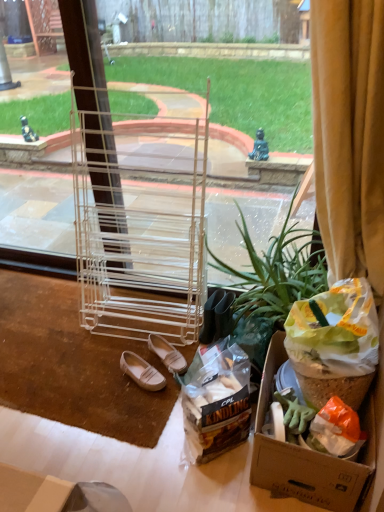
The width and height of the screenshot is (384, 512). Describe the element at coordinates (276, 273) in the screenshot. I see `green leafy plant at center` at that location.

Describe the element at coordinates (141, 372) in the screenshot. I see `white leather shoes at lower center, which is counted as the 2th footwear, starting from the right` at that location.

Measure the distance between yellow velvet curtain at right and camera.

The distance of yellow velvet curtain at right from camera is 3.54 feet.

What is the approximate width of translucent plastic bag of kindling at lower center?

translucent plastic bag of kindling at lower center is 9.59 inches wide.

At what (x,y) coordinates should I click in order to perform the action: click on green leafy plant at center. Please return your answer as a coordinate pair (x, y). The image size is (384, 512). Looking at the image, I should click on (276, 273).

Which of these two, white leather shoes at lower center, which is the 1th footwear from left to right, or translucent plastic bag of kindling at lower center, is thinner?

translucent plastic bag of kindling at lower center.

In the image, is white leather shoes at lower center, which is the 1th footwear from left to right, positioned in front of or behind translucent plastic bag of kindling at lower center?

Visually, white leather shoes at lower center, which is the 1th footwear from left to right, is located behind translucent plastic bag of kindling at lower center.

From the image's perspective, is white leather shoes at lower center, which is the 1th footwear from left to right, over translucent plastic bag of kindling at lower center?

Yes, from the image's perspective, white leather shoes at lower center, which is the 1th footwear from left to right, is on top of translucent plastic bag of kindling at lower center.

Considering the relative sizes of clear plastic rack at center and translucent plastic bag of kindling at lower center in the image provided, is clear plastic rack at center smaller than translucent plastic bag of kindling at lower center?

No.

Is point (209, 228) positioned in front of point (222, 405)?

That is False.

From a real-world perspective, is clear plastic rack at center physically below translucent plastic bag of kindling at lower center?

No, from a real-world perspective, clear plastic rack at center is not below translucent plastic bag of kindling at lower center.

Find the location of a particular element. window screen on the left of the translucent plastic bag of kindling at lower center is located at coordinates (203, 94).

Between white leather shoes at lower center, which is the 1th footwear from left to right, and clear plastic rack at center, which one appears on the left side from the viewer's perspective?

Positioned to the left is white leather shoes at lower center, which is the 1th footwear from left to right.

Is point (120, 360) less distant than point (162, 118)?

That is False.

Is white leather shoes at lower center, which is counted as the 2th footwear, starting from the right, wider than clear plastic rack at center?

Indeed, white leather shoes at lower center, which is counted as the 2th footwear, starting from the right, has a greater width compared to clear plastic rack at center.

Considering the sizes of objects white leather shoes at lower center, which is counted as the 2th footwear, starting from the right, and clear plastic rack at center in the image provided, who is bigger, white leather shoes at lower center, which is counted as the 2th footwear, starting from the right, or clear plastic rack at center?

Bigger between the two is clear plastic rack at center.

Looking at this image, which is more to the right, green leafy plant at center or clear plastic rack at center?

green leafy plant at center is more to the right.

Is green leafy plant at center facing towards clear plastic rack at center?

Yes, green leafy plant at center is aimed at clear plastic rack at center.

Is point (299, 229) less distant than point (25, 201)?

Yes, point (299, 229) is closer to viewer.

Is green leafy plant at center closer to camera compared to clear plastic rack at center?

No, green leafy plant at center is behind clear plastic rack at center.

Looking at their sizes, would you say leather at center, the 2th footwear when ordered from left to right, is wider or thinner than white leather shoes at lower center, which is counted as the 2th footwear, starting from the right?

leather at center, the 2th footwear when ordered from left to right, is thinner than white leather shoes at lower center, which is counted as the 2th footwear, starting from the right.

Consider the image. Which is closer, (181, 370) or (140, 379)?

The point (140, 379) is closer.

Is leather at center, which ranks as the 1th footwear in right-to-left order, outside of white leather shoes at lower center, which is counted as the 2th footwear, starting from the right?

leather at center, which ranks as the 1th footwear in right-to-left order, lies outside white leather shoes at lower center, which is counted as the 2th footwear, starting from the right,'s area.

In the scene shown: Does green leafy plant at center have a larger size compared to yellow velvet curtain at right?

Correct, green leafy plant at center is larger in size than yellow velvet curtain at right.

How different are the orientations of green leafy plant at center and yellow velvet curtain at right in degrees?

green leafy plant at center and yellow velvet curtain at right are facing 87.1 degrees away from each other.

Is green leafy plant at center inside the boundaries of yellow velvet curtain at right, or outside?

green leafy plant at center is outside yellow velvet curtain at right.

From the image's perspective, which object appears higher, green leafy plant at center or yellow velvet curtain at right?

yellow velvet curtain at right appears higher in the image.

From the image's perspective, which is above, yellow velvet curtain at right or clear plastic rack at center?

clear plastic rack at center appears higher in the image.

Does yellow velvet curtain at right have a lesser width compared to clear plastic rack at center?

In fact, yellow velvet curtain at right might be wider than clear plastic rack at center.

Could clear plastic rack at center be considered to be inside yellow velvet curtain at right?

No, clear plastic rack at center is not a part of yellow velvet curtain at right.

Are yellow velvet curtain at right and clear plastic rack at center located far from each other?

That's right, there is a large distance between yellow velvet curtain at right and clear plastic rack at center.

This screenshot has height=512, width=384. In order to click on the 1st footwear located beneath the translucent plastic bag of kindling at lower center (from a real-world perspective) in this screenshot , I will do `click(141, 372)`.

The height and width of the screenshot is (512, 384). I want to click on waste on the right of clear plastic rack at center, so click(x=217, y=405).

Which object lies further to the anchor point white leather shoes at lower center, which is the 1th footwear from left to right, translucent plastic bag of kindling at lower center or leather at center, the 2th footwear when ordered from left to right?

translucent plastic bag of kindling at lower center.

Which object lies nearer to the anchor point yellow velvet curtain at right, white leather shoes at lower center, which is the 1th footwear from left to right, or leather at center, the 2th footwear when ordered from left to right?

Among the two, leather at center, the 2th footwear when ordered from left to right, is located nearer to yellow velvet curtain at right.

Looking at the image, which one is located closer to white leather shoes at lower center, which is the 1th footwear from left to right, green leafy plant at center or leather at center, which ranks as the 1th footwear in right-to-left order?

leather at center, which ranks as the 1th footwear in right-to-left order.

When comparing their distances from clear plastic rack at center, does leather at center, which ranks as the 1th footwear in right-to-left order, or yellow velvet curtain at right seem further?

leather at center, which ranks as the 1th footwear in right-to-left order, lies further to clear plastic rack at center than the other object.

Looking at this image, from the image, which object appears to be farther from translucent plastic bag of kindling at lower center, clear plastic rack at center or white leather shoes at lower center, which is the 1th footwear from left to right?

clear plastic rack at center.

Based on the photo, looking at the image, which one is located closer to clear plastic rack at center, translucent plastic bag of kindling at lower center or white leather shoes at lower center, which is counted as the 2th footwear, starting from the right?

Among the two, translucent plastic bag of kindling at lower center is located nearer to clear plastic rack at center.

Looking at the image, which one is located closer to white leather shoes at lower center, which is counted as the 2th footwear, starting from the right, green leafy plant at center or translucent plastic bag of kindling at lower center?

translucent plastic bag of kindling at lower center is closer to white leather shoes at lower center, which is counted as the 2th footwear, starting from the right.

Which object lies nearer to the anchor point clear plastic rack at center, leather at center, which ranks as the 1th footwear in right-to-left order, or translucent plastic bag of kindling at lower center?

Based on the image, translucent plastic bag of kindling at lower center appears to be nearer to clear plastic rack at center.

I want to click on curtain between clear plastic rack at center and white leather shoes at lower center, which is counted as the 2th footwear, starting from the right, from top to bottom, so click(x=349, y=135).

I want to click on footwear between clear plastic rack at center and white leather shoes at lower center, which is counted as the 2th footwear, starting from the right, from top to bottom, so click(167, 354).

Identify the location of houseplant that lies between yellow velvet curtain at right and translucent plastic bag of kindling at lower center from top to bottom. (276, 273).

Where is `curtain between clear plastic rack at center and green leafy plant at center from top to bottom`? This screenshot has height=512, width=384. curtain between clear plastic rack at center and green leafy plant at center from top to bottom is located at coordinates (349, 135).